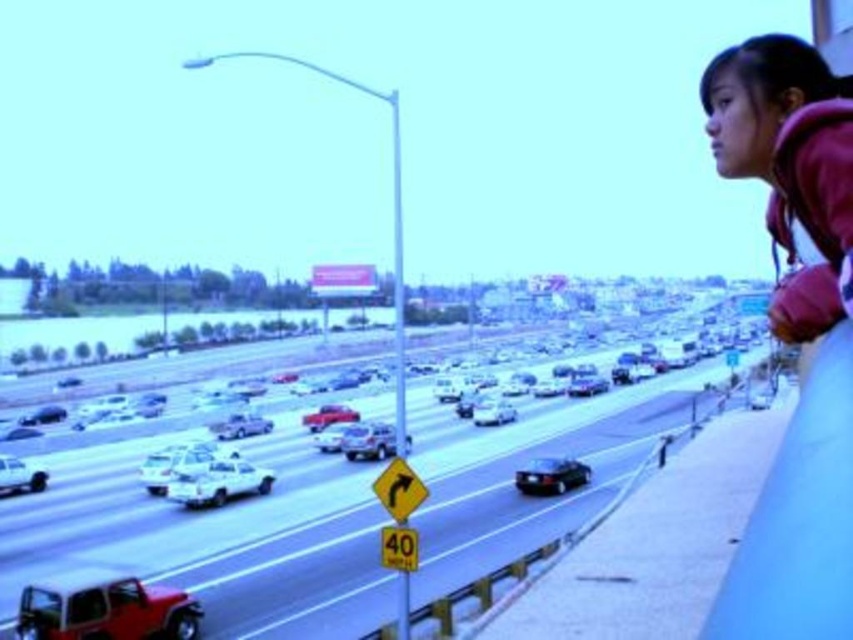
Can you confirm if shiny black sedan at center is positioned to the left of white glossy sedan at lower left?

In fact, shiny black sedan at center is to the right of white glossy sedan at lower left.

Who is lower down, shiny black sedan at center or white glossy sedan at lower left?

shiny black sedan at center

The image size is (853, 640). Identify the location of shiny black sedan at center. (550, 476).

Does metallic silver cars at center appear on the right side of purple fleece jacket at upper right?

In fact, metallic silver cars at center is to the left of purple fleece jacket at upper right.

Can you confirm if metallic silver cars at center is positioned to the left of purple fleece jacket at upper right?

Yes, metallic silver cars at center is to the left of purple fleece jacket at upper right.

Locate an element on the screen. metallic silver cars at center is located at coordinates [x=213, y=541].

Consider the image. Can you confirm if purple fleece jacket at upper right is bigger than white matte sedan at lower left?

Yes.

Does purple fleece jacket at upper right have a greater height compared to white matte sedan at lower left?

Correct, purple fleece jacket at upper right is much taller as white matte sedan at lower left.

Who is more distant from viewer, (747,90) or (218,470)?

The point (218,470) is more distant.

Identify the location of purple fleece jacket at upper right. (793, 332).